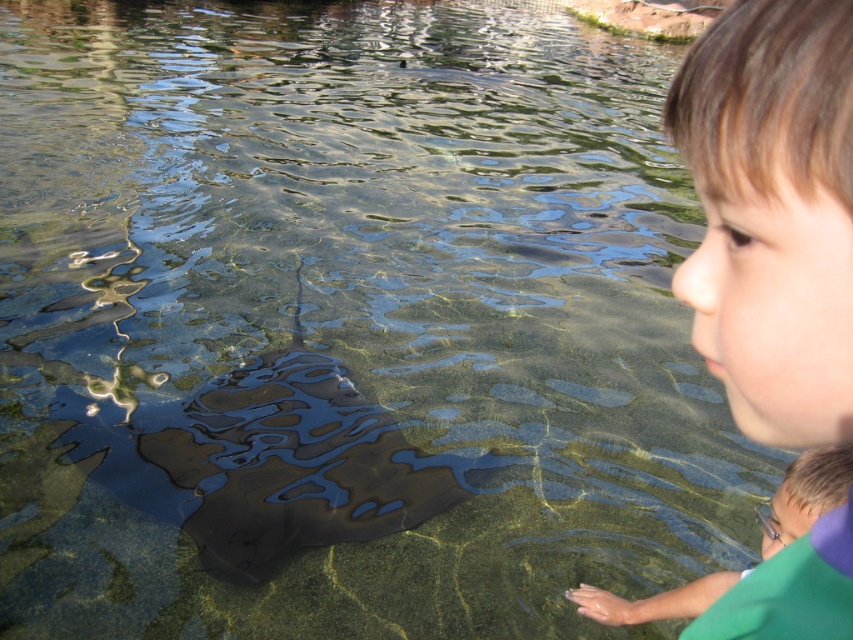
Question: Which point is closer to the camera?

Choices:
 (A) (759, 592)
 (B) (323, 467)

Answer: (A)

Question: Does shiny black stingray at center appear under green matte shirt at lower right?

Choices:
 (A) no
 (B) yes

Answer: (A)

Question: Which object is farther from the camera taking this photo?

Choices:
 (A) green matte shirt at lower right
 (B) shiny black stingray at center

Answer: (B)

Question: Does shiny black stingray at center appear on the right side of green matte shirt at lower right?

Choices:
 (A) yes
 (B) no

Answer: (B)

Question: Is smooth skin face at upper right above shiny black stingray at center?

Choices:
 (A) yes
 (B) no

Answer: (A)

Question: Which object appears farthest from the camera in this image?

Choices:
 (A) shiny black stingray at center
 (B) smooth skin face at upper right

Answer: (A)